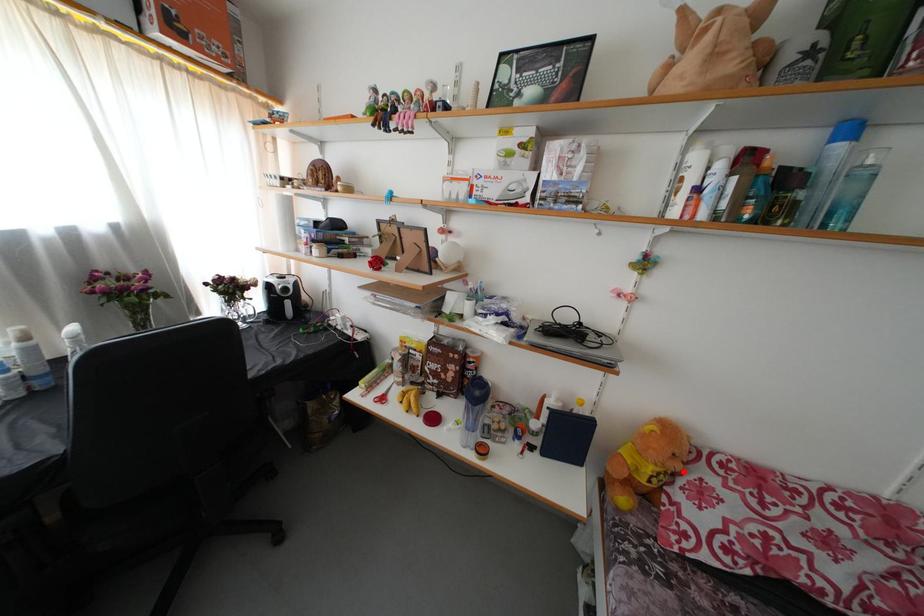
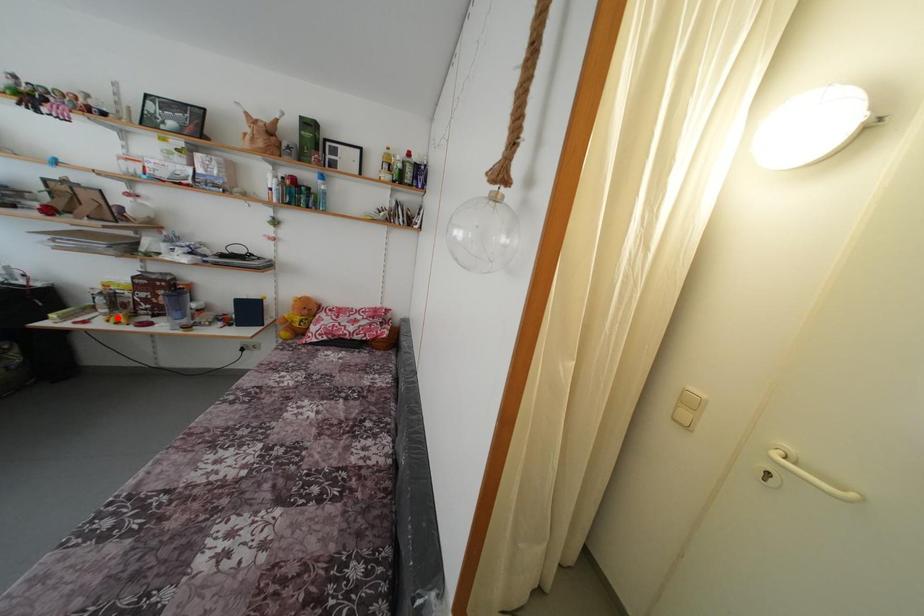
I am providing you with two images of the same scene from different viewpoints. A red point is marked on the first image and another point is marked on the second image. Are the points marked in image1 and image2 representing the same 3D position?

No